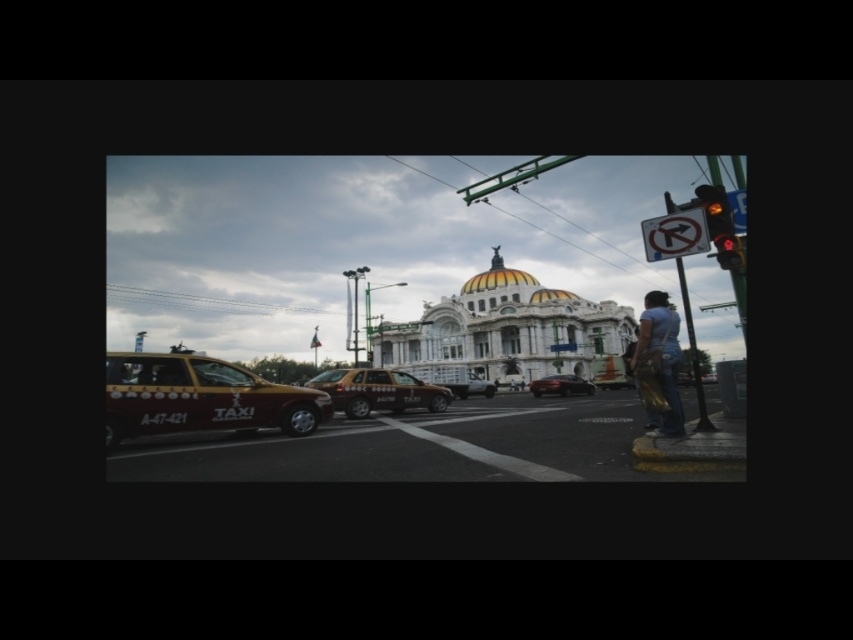
Question: Estimate the real-world distances between objects in this image. Which object is closer to the amber glass traffic light at upper right?

Choices:
 (A) denim pants at lower right
 (B) shiny black sedan at center
 (C) yellow glossy taxi at left
 (D) metallic silver car at center

Answer: (A)

Question: Which object is closer to the camera taking this photo?

Choices:
 (A) matte white dome at center
 (B) yellow metallic taxi at center
 (C) metallic silver car at center

Answer: (B)

Question: Considering the real-world distances, which object is farthest from the denim pants at lower right?

Choices:
 (A) white plastic sign at upper right
 (B) matte white dome at center
 (C) red glass traffic light at upper right

Answer: (B)

Question: Can you confirm if amber glass traffic light at upper right is wider than red glass traffic light at upper right?

Choices:
 (A) no
 (B) yes

Answer: (B)

Question: Does red glass traffic light at upper right have a greater width compared to metallic rectangular sign at center?

Choices:
 (A) no
 (B) yes

Answer: (A)

Question: Does yellow metallic taxi at center have a lesser width compared to metallic silver car at center?

Choices:
 (A) yes
 (B) no

Answer: (B)